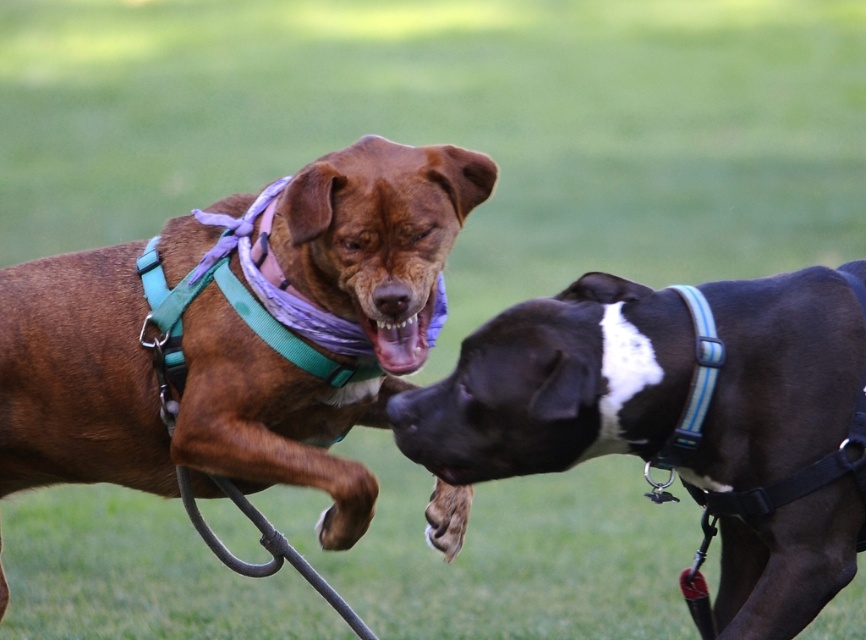
Question: Is brown leather harness at center below black smooth dog at right?

Choices:
 (A) no
 (B) yes

Answer: (A)

Question: Is brown leather harness at center above matte brown dog mouth at center?

Choices:
 (A) yes
 (B) no

Answer: (B)

Question: Is brown leather harness at center below black smooth dog at right?

Choices:
 (A) yes
 (B) no

Answer: (B)

Question: Among these objects, which one is nearest to the camera?

Choices:
 (A) brown leather harness at center
 (B) black smooth dog at right
 (C) matte brown dog mouth at center

Answer: (B)

Question: Which point is closer to the camera taking this photo?

Choices:
 (A) (315, 172)
 (B) (847, 378)
 (C) (409, 300)

Answer: (B)

Question: Which object is the closest to the matte brown dog mouth at center?

Choices:
 (A) black smooth dog at right
 (B) brown leather harness at center

Answer: (B)